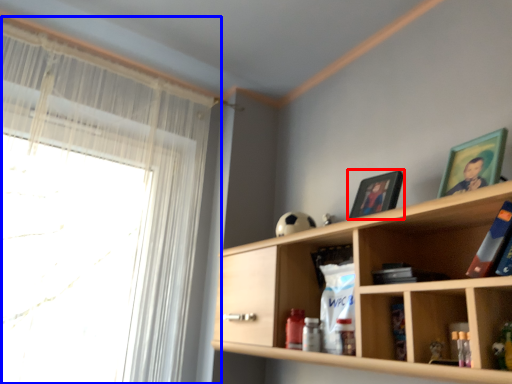
Question: Among these objects, which one is farthest to the camera, picture frame (highlighted by a red box) or window (highlighted by a blue box)?

Choices:
 (A) picture frame
 (B) window

Answer: (B)